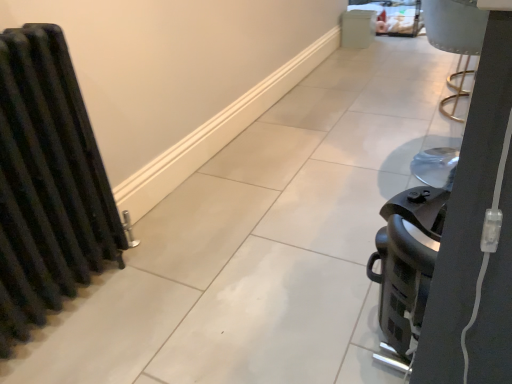
Question: Considering their positions, is white matte cabinet at upper center, the second appliance from the bottom, located in front of or behind black plastic coffee maker at right, which is the 1th appliance in front-to-back order?

Choices:
 (A) behind
 (B) front

Answer: (A)

Question: From a real-world perspective, is white matte cabinet at upper center, which is counted as the first appliance, starting from the right, above or below black plastic coffee maker at right, positioned as the 1th appliance in bottom-to-top order?

Choices:
 (A) above
 (B) below

Answer: (B)

Question: Which object is the closest to the black matte radiator at left?

Choices:
 (A) white matte cabinet at upper center, which is counted as the first appliance, starting from the right
 (B) black plastic coffee maker at right, the first appliance positioned from the left

Answer: (B)

Question: Estimate the real-world distances between objects in this image. Which object is farther from the black matte radiator at left?

Choices:
 (A) white matte cabinet at upper center, arranged as the first appliance when viewed from the back
 (B) black plastic coffee maker at right, marked as the 2th appliance in a back-to-front arrangement

Answer: (A)